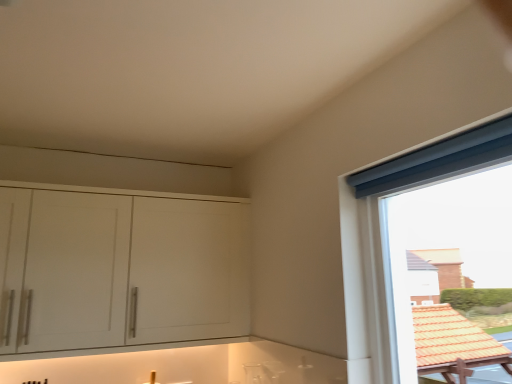
Question: From a real-world perspective, relative to white matte cabinet at left, is blue fabric curtain at upper right vertically above or below?

Choices:
 (A) above
 (B) below

Answer: (B)

Question: Considering the positions of blue fabric curtain at upper right and white matte cabinet at left in the image, is blue fabric curtain at upper right taller or shorter than white matte cabinet at left?

Choices:
 (A) tall
 (B) short

Answer: (A)

Question: Is blue fabric curtain at upper right wider or thinner than white matte cabinet at left?

Choices:
 (A) thin
 (B) wide

Answer: (A)

Question: In the image, is white matte cabinet at left on the left side or the right side of blue fabric curtain at upper right?

Choices:
 (A) right
 (B) left

Answer: (B)

Question: Considering the positions of white matte cabinet at left and blue fabric curtain at upper right in the image, is white matte cabinet at left wider or thinner than blue fabric curtain at upper right?

Choices:
 (A) thin
 (B) wide

Answer: (B)

Question: Considering the positions of point (157, 249) and point (357, 198), is point (157, 249) closer or farther from the camera than point (357, 198)?

Choices:
 (A) closer
 (B) farther

Answer: (B)

Question: From their relative heights in the image, would you say white matte cabinet at left is taller or shorter than blue fabric curtain at upper right?

Choices:
 (A) tall
 (B) short

Answer: (B)